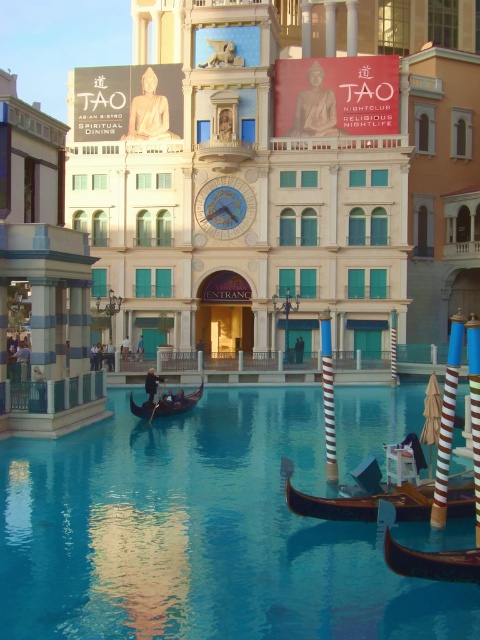
Is point (407, 556) behind point (450, 371)?

That is False.

How far apart are wooden gondola at lower right and striped wood pole at right?

They are 6.75 meters apart.

Is point (440, 560) positioned in front of point (447, 444)?

Yes, it is.

I want to click on wooden gondola at lower right, so click(x=431, y=561).

Who is positioned more to the left, wooden gondola at center or striped wood pole at right?

wooden gondola at center is more to the left.

Which is behind, point (403, 483) or point (440, 484)?

The point (403, 483) is behind.

Does point (283, 467) lie in front of point (444, 420)?

No, it is behind (444, 420).

At what (x,y) coordinates should I click in order to perform the action: click on wooden gondola at center. Please return your answer as a coordinate pair (x, y). This screenshot has width=480, height=640. Looking at the image, I should click on (360, 497).

Can you confirm if striped wood pole at right is positioned to the left of dark brown polished wood gondola at center?

Incorrect, striped wood pole at right is not on the left side of dark brown polished wood gondola at center.

Is striped wood pole at right further to the viewer compared to dark brown polished wood gondola at center?

No, striped wood pole at right is closer to the viewer.

Identify the location of striped wood pole at right. (446, 420).